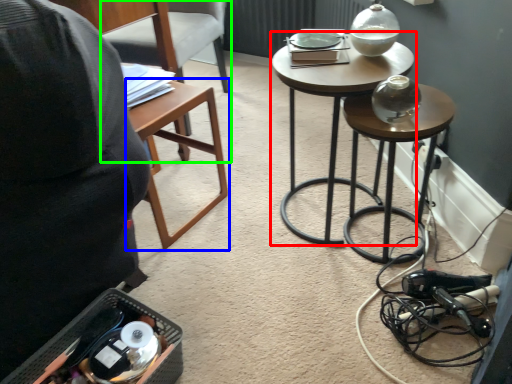
Question: Which is farther away from stool (highlighted by a red box)? table (highlighted by a blue box) or chair (highlighted by a green box)?

Choices:
 (A) table
 (B) chair

Answer: (B)